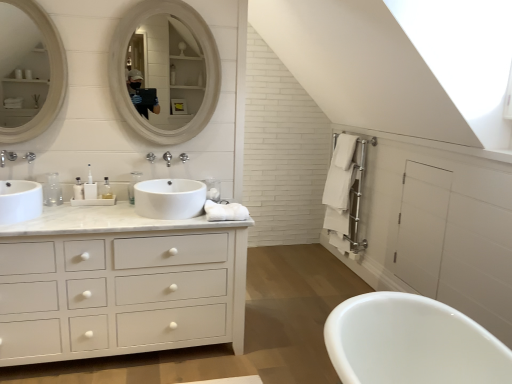
The image size is (512, 384). Describe the element at coordinates (19, 201) in the screenshot. I see `white glossy sink at left, the first sink from the left` at that location.

The width and height of the screenshot is (512, 384). Describe the element at coordinates (411, 342) in the screenshot. I see `white glossy bathtub at lower right` at that location.

Locate an element on the screen. clear plastic bottle at center, which is counted as the 1th toiletry, starting from the left is located at coordinates (52, 190).

Where is `white glossy mirror at upper center, the second mirror when ordered from left to right`? white glossy mirror at upper center, the second mirror when ordered from left to right is located at coordinates (168, 69).

Which object is positioned more to the left, white matte cabinet at left or white glossy sink at left, the first sink from the left?

white glossy sink at left, the first sink from the left, is more to the left.

Does white matte cabinet at left turn towards white glossy sink at left, positioned as the second sink in right-to-left order?

No, white matte cabinet at left does not turn towards white glossy sink at left, positioned as the second sink in right-to-left order.

From the image's perspective, is white matte cabinet at left above or below white glossy sink at left, positioned as the second sink in right-to-left order?

Based on their image positions, white matte cabinet at left is located beneath white glossy sink at left, positioned as the second sink in right-to-left order.

From a real-world perspective, who is located lower, white matte cabinet at left or white glossy sink at left, the first sink from the left?

From a 3D spatial view, white matte cabinet at left is below.

Find the location of `the 2nd sink in front of the clear plastic bottle at center, which ranks as the 2th toiletry in right-to-left order`. the 2nd sink in front of the clear plastic bottle at center, which ranks as the 2th toiletry in right-to-left order is located at coordinates (19, 201).

In the scene shown: Is clear plastic bottle at center, which is counted as the 1th toiletry, starting from the left, taller than white glossy sink at left, positioned as the second sink in right-to-left order?

Correct, clear plastic bottle at center, which is counted as the 1th toiletry, starting from the left, is much taller as white glossy sink at left, positioned as the second sink in right-to-left order.

Is the depth of clear plastic bottle at center, which ranks as the 2th toiletry in right-to-left order, greater than that of white glossy sink at left, positioned as the second sink in right-to-left order?

Yes, clear plastic bottle at center, which ranks as the 2th toiletry in right-to-left order, is further from the viewer.

Is clear plastic bottle at center, which ranks as the 2th toiletry in right-to-left order, spatially inside white glossy sink at left, positioned as the second sink in right-to-left order, or outside of it?

clear plastic bottle at center, which ranks as the 2th toiletry in right-to-left order, is spatially situated outside white glossy sink at left, positioned as the second sink in right-to-left order.

Based on the photo, is white glossy sink at center, positioned as the 1th sink in right-to-left order, shorter than white glossy sink at left, the first sink from the left?

Incorrect, the height of white glossy sink at center, positioned as the 1th sink in right-to-left order, does not fall short of that of white glossy sink at left, the first sink from the left.

Is white glossy sink at center, positioned as the 1th sink in right-to-left order, outside of white glossy sink at left, positioned as the second sink in right-to-left order?

Yes, white glossy sink at center, positioned as the 1th sink in right-to-left order, is not within white glossy sink at left, positioned as the second sink in right-to-left order.

In the image, is white glossy sink at center, arranged as the second sink when viewed from the left, positioned in front of or behind white glossy sink at left, the first sink from the left?

Clearly, white glossy sink at center, arranged as the second sink when viewed from the left, is behind white glossy sink at left, the first sink from the left.

From a real-world perspective, is white glossy sink at center, positioned as the 1th sink in right-to-left order, physically above white glossy sink at left, positioned as the second sink in right-to-left order?

No.

Identify the location of soap dispenser below the matte silver faucet at left, which is the 2th faucet in back-to-front order (from the image's perspective). click(133, 185).

Does white plastic soap dispenser at center appear on the left side of matte silver faucet at left, which ranks as the second faucet in right-to-left order?

No.

From the image's perspective, is white plastic soap dispenser at center beneath matte silver faucet at left, the first faucet positioned from the left?

Yes.

Between point (44, 201) and point (158, 18), which one is positioned behind?

The point (158, 18) is farther from the camera.

From the image's perspective, who appears lower, clear plastic bottle at center, which ranks as the 2th toiletry in right-to-left order, or white glossy mirror at upper center, the second mirror when ordered from left to right?

clear plastic bottle at center, which ranks as the 2th toiletry in right-to-left order.

From a real-world perspective, is clear plastic bottle at center, which is counted as the 1th toiletry, starting from the left, on white glossy mirror at upper center, which is the 1th mirror in right-to-left order?

No, from a real-world perspective, clear plastic bottle at center, which is counted as the 1th toiletry, starting from the left, is not above white glossy mirror at upper center, which is the 1th mirror in right-to-left order.

How far apart are clear plastic bottle at center, which is counted as the 1th toiletry, starting from the left, and white glossy mirror at upper center, the second mirror when ordered from left to right?

They are 36.00 inches apart.

From a real-world perspective, starting from the white glossy bathtub at lower right, which faucet is the 2nd one vertically above it? Please provide its 2D coordinates.

[(151, 157)]

Considering the sizes of brushed metal faucet at upper center, the 2th faucet from the left, and white glossy bathtub at lower right in the image, is brushed metal faucet at upper center, the 2th faucet from the left, bigger or smaller than white glossy bathtub at lower right?

Clearly, brushed metal faucet at upper center, the 2th faucet from the left, is smaller in size than white glossy bathtub at lower right.

Does point (49, 194) lie in front of point (81, 192)?

Yes, it is.

From a real-world perspective, which object stands above the other?

In real-world perspective, clear plastic bottle at center, which is counted as the 1th toiletry, starting from the left, is above.

Considering the sizes of clear plastic bottle at center, which ranks as the 2th toiletry in right-to-left order, and clear plastic bottle at center, the first toiletry when ordered from right to left, in the image, is clear plastic bottle at center, which ranks as the 2th toiletry in right-to-left order, bigger or smaller than clear plastic bottle at center, the first toiletry when ordered from right to left,?

In the image, clear plastic bottle at center, which ranks as the 2th toiletry in right-to-left order, appears to be larger than clear plastic bottle at center, the first toiletry when ordered from right to left.

Identify the location of bathroom cabinet in front of the white glossy sink at left, the first sink from the left. The height and width of the screenshot is (384, 512). (118, 284).

The image size is (512, 384). In order to click on sink that is the 1st one below the clear plastic bottle at center, which ranks as the 2th toiletry in right-to-left order (from a real-world perspective) in this screenshot , I will do `click(19, 201)`.

Based on their spatial positions, is clear plastic bottle at center, which ranks as the 2th toiletry in right-to-left order, or white glossy mirror at upper center, the second mirror when ordered from left to right, further from white plastic soap dispenser at center?

white glossy mirror at upper center, the second mirror when ordered from left to right, is further to white plastic soap dispenser at center.

Looking at the image, which one is located further to white wooden mirror at upper left, marked as the 2th mirror in a right-to-left arrangement, clear plastic bottle at center, which ranks as the 2th toiletry in right-to-left order, or white glossy sink at left, positioned as the second sink in right-to-left order?

clear plastic bottle at center, which ranks as the 2th toiletry in right-to-left order, is further to white wooden mirror at upper left, marked as the 2th mirror in a right-to-left arrangement.

Based on their spatial positions, is brushed metal faucet at left or white matte cabinet at left further from clear plastic bottle at center, which is counted as the 1th toiletry, starting from the left?

white matte cabinet at left lies further to clear plastic bottle at center, which is counted as the 1th toiletry, starting from the left, than the other object.

Estimate the real-world distances between objects in this image. Which object is closer to brushed metal faucet at left, matte silver faucet at left, which ranks as the second faucet in right-to-left order, or white glossy sink at center, positioned as the 1th sink in right-to-left order?

matte silver faucet at left, which ranks as the second faucet in right-to-left order.

When comparing their distances from brushed metal faucet at left, does brushed metal faucet at upper center, marked as the first faucet in a right-to-left arrangement, or white matte cabinet at left seem further?

Among the two, white matte cabinet at left is located further to brushed metal faucet at left.

Based on the photo, from the image, which object appears to be nearer to white glossy bathtub at lower right, brushed metal faucet at upper center, the 2th faucet from the left, or white glossy sink at center, positioned as the 1th sink in right-to-left order?

The object closer to white glossy bathtub at lower right is white glossy sink at center, positioned as the 1th sink in right-to-left order.

When comparing their distances from white glossy sink at center, arranged as the second sink when viewed from the left, does white plastic soap dispenser at center or white glossy sink at left, the first sink from the left, seem closer?

The object closer to white glossy sink at center, arranged as the second sink when viewed from the left, is white plastic soap dispenser at center.

Estimate the real-world distances between objects in this image. Which object is further from white matte cabinet at left, clear plastic bottle at center, which is counted as the 1th toiletry, starting from the left, or brushed metal faucet at left?

brushed metal faucet at left is further to white matte cabinet at left.

Identify the location of soap dispenser between brushed metal faucet at left and brushed metal faucet at upper center, the first faucet positioned from the back, in the horizontal direction. (133, 185).

Find the location of a particular element. Image resolution: width=512 pixels, height=384 pixels. soap dispenser located between brushed metal faucet at left and white glossy bathtub at lower right in the left-right direction is located at coordinates (133, 185).

Identify the location of tap between white wooden mirror at upper left, the 1th mirror viewed from the left, and white glossy sink at left, the first sink from the left, vertically. The height and width of the screenshot is (384, 512). (7, 157).

Where is `sink between clear plastic bottle at center, which is counted as the 1th toiletry, starting from the left, and white glossy bathtub at lower right`? sink between clear plastic bottle at center, which is counted as the 1th toiletry, starting from the left, and white glossy bathtub at lower right is located at coordinates (170, 197).